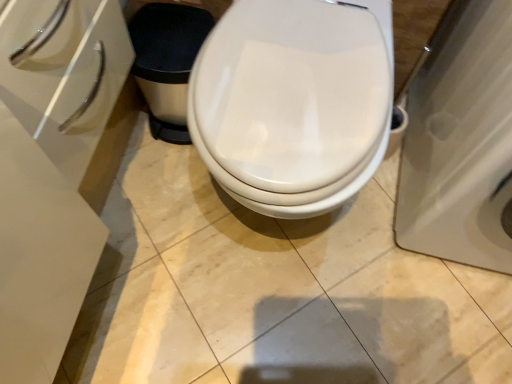
Question: From a real-world perspective, is white glossy porcelain at right physically located above or below white glossy toilet at center?

Choices:
 (A) below
 (B) above

Answer: (B)

Question: Is white glossy porcelain at right bigger or smaller than white glossy toilet at center?

Choices:
 (A) small
 (B) big

Answer: (B)

Question: In terms of height, does white glossy porcelain at right look taller or shorter compared to white glossy toilet at center?

Choices:
 (A) tall
 (B) short

Answer: (A)

Question: In terms of height, does white glossy toilet at center look taller or shorter compared to white glossy porcelain at right?

Choices:
 (A) tall
 (B) short

Answer: (B)

Question: Does point (257, 69) appear closer or farther from the camera than point (499, 145)?

Choices:
 (A) farther
 (B) closer

Answer: (A)

Question: Relative to white glossy porcelain at right, is white glossy toilet at center in front or behind?

Choices:
 (A) behind
 (B) front

Answer: (A)

Question: Do you think white glossy toilet at center is within white glossy porcelain at right, or outside of it?

Choices:
 (A) inside
 (B) outside

Answer: (B)